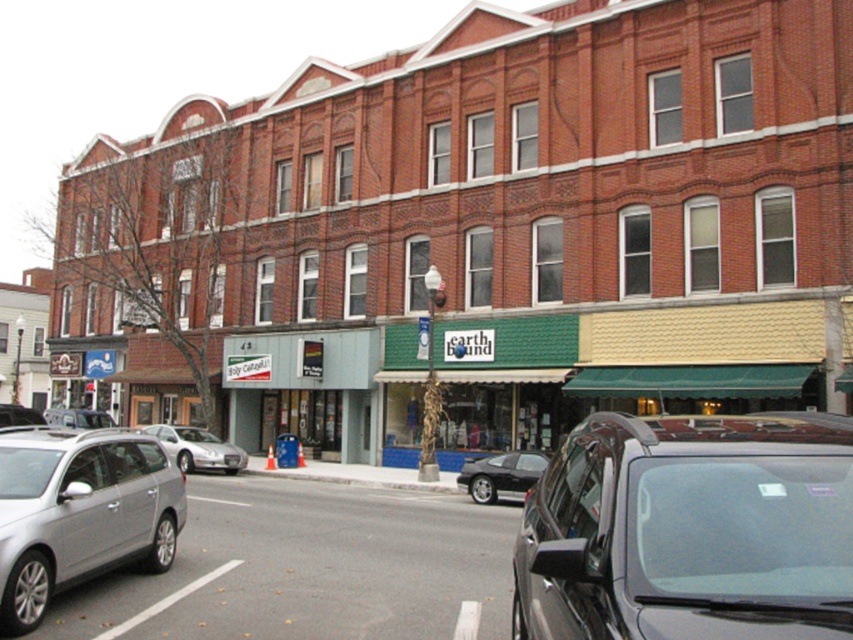
Which of these two, silver metallic sedan at center or satin silver sedan at center, stands shorter?

silver metallic sedan at center

Is silver metallic sedan at center positioned in front of satin silver sedan at center?

No, it is not.

Image resolution: width=853 pixels, height=640 pixels. What do you see at coordinates (196, 449) in the screenshot?
I see `silver metallic sedan at center` at bounding box center [196, 449].

This screenshot has width=853, height=640. What are the coordinates of `silver metallic sedan at center` in the screenshot? It's located at (196, 449).

Who is positioned more to the right, silver metallic car at lower left or silver metallic sedan at center-left?

silver metallic car at lower left

Find the location of a particular element. Image resolution: width=853 pixels, height=640 pixels. silver metallic car at lower left is located at coordinates (80, 513).

Find the location of a particular element. silver metallic car at lower left is located at coordinates (80, 513).

Is silver metallic sedan at center to the left of silver metallic sedan at center-left from the viewer's perspective?

Incorrect, silver metallic sedan at center is not on the left side of silver metallic sedan at center-left.

Who is positioned more to the left, silver metallic sedan at center or silver metallic sedan at center-left?

From the viewer's perspective, silver metallic sedan at center-left appears more on the left side.

Between point (215, 448) and point (53, 417), which one is positioned in front?

Point (215, 448) is in front.

This screenshot has height=640, width=853. In order to click on silver metallic sedan at center in this screenshot , I will do `click(196, 449)`.